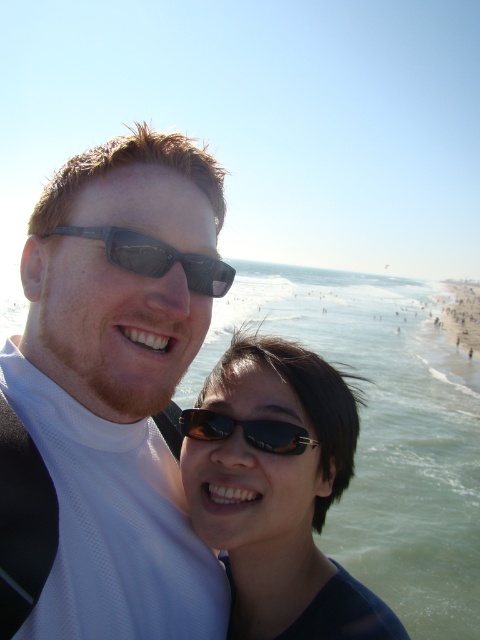
You are a photographer taking a picture of the clear blue water at center and the sunglasses at center. Which object is located to the right side of the other?

The sunglasses at center are located to the right of the clear blue water at center.